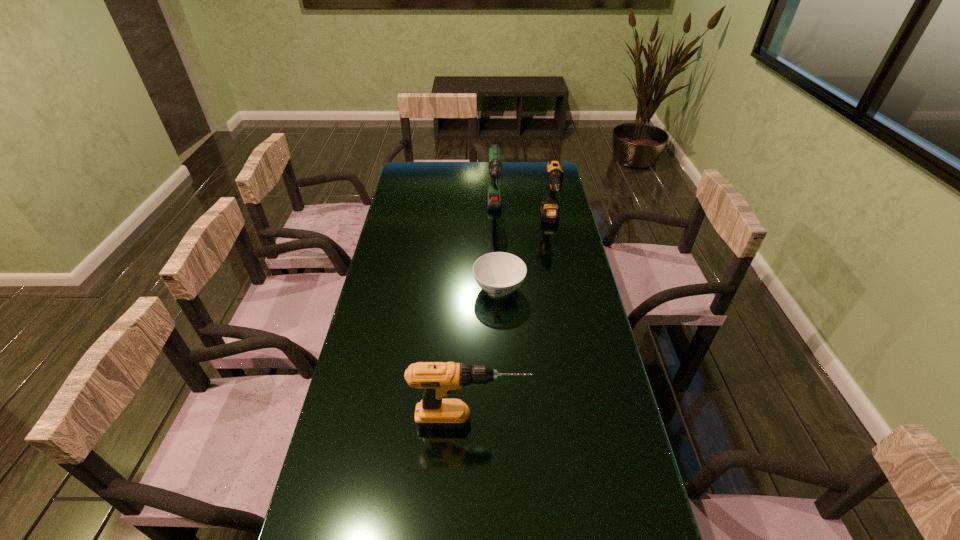
Where is `the rightmost object`? The height and width of the screenshot is (540, 960). the rightmost object is located at coordinates (550, 213).

This screenshot has width=960, height=540. I want to click on the nearest object, so click(x=437, y=379).

This screenshot has width=960, height=540. What are the coordinates of `the shortest object` in the screenshot? It's located at (498, 273).

At what (x,y) coordinates should I click in order to perform the action: click on chinaware. Please return your answer as a coordinate pair (x, y). Image resolution: width=960 pixels, height=540 pixels. Looking at the image, I should click on (498, 273).

The width and height of the screenshot is (960, 540). What are the coordinates of `free spot located 0.400m at the tip of the rightmost object` in the screenshot? It's located at (567, 306).

Locate an element on the screen. This screenshot has width=960, height=540. free space located 0.180m at the tip of the nearest drill is located at coordinates (595, 421).

This screenshot has width=960, height=540. In order to click on vacant space situated 0.200m on the front of the third farthest object in this screenshot , I will do (x=502, y=355).

Where is `object located at the right edge`? This screenshot has height=540, width=960. object located at the right edge is located at coordinates (550, 213).

Locate an element on the screen. vacant space at the far edge of the desktop is located at coordinates (458, 171).

This screenshot has height=540, width=960. What are the coordinates of `free space at the left edge of the desktop` in the screenshot? It's located at (397, 250).